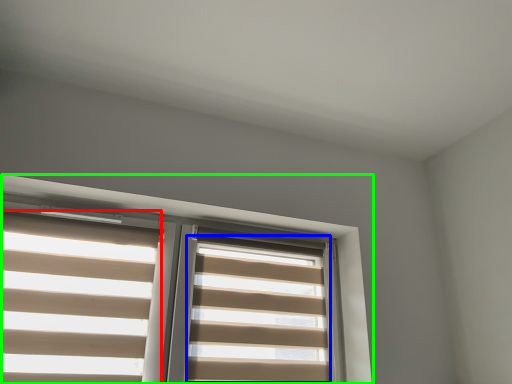
Question: Which object is the farthest from blind (highlighted by a red box)? Choose among these: blind (highlighted by a blue box) or window (highlighted by a green box).

Choices:
 (A) blind
 (B) window

Answer: (A)